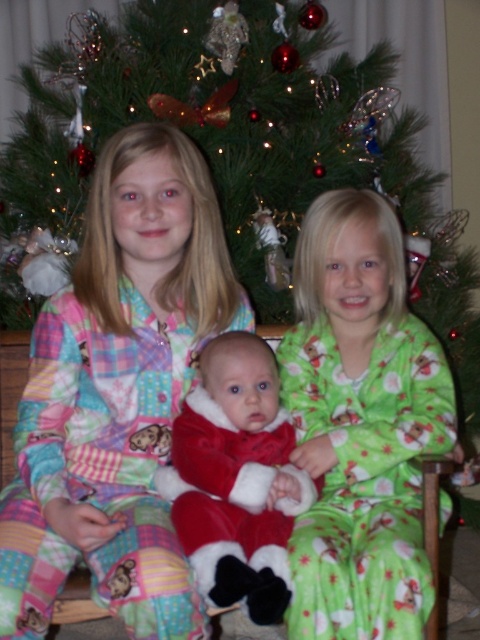
Looking at this image, you are standing in front of the Christmas tree and want to find the patchwork pajamas at center. According to the coordinates provided, where should you look?

You should look at point 0.616 on the x axis and point 0.246 on the y axis to find the patchwork pajamas at center.

In the festive scene with a Christmas tree, there are two children wearing patchwork pajamas at center and velvet red santa suit at center. Which child is taller?

The patchwork pajamas at center is taller than the velvet red santa suit at center, so the child wearing the patchwork pajamas at center is taller.